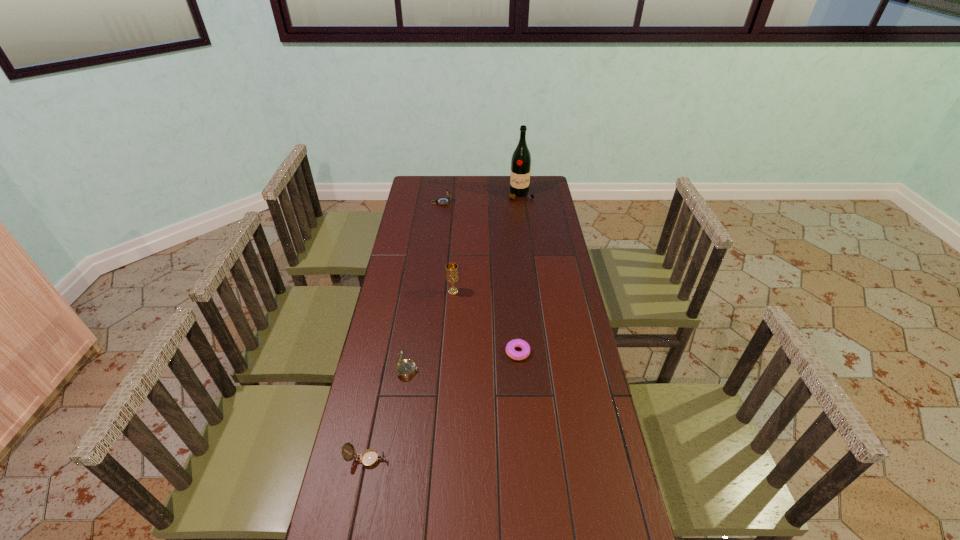
Identify the location of unoccupied position between the chalice and the shortest object. This screenshot has width=960, height=540. (486, 322).

Locate an element on the screen. This screenshot has width=960, height=540. vacant space that is in between the chalice and the second farthest compass is located at coordinates (430, 331).

Find the location of a particular element. This screenshot has height=540, width=960. free space between the third object from right to left and the doughnut is located at coordinates (486, 322).

At what (x,y) coordinates should I click in order to perform the action: click on free spot between the farthest compass and the third farthest object. Please return your answer as a coordinate pair (x, y). The height and width of the screenshot is (540, 960). Looking at the image, I should click on (447, 247).

Locate an element on the screen. This screenshot has height=540, width=960. free space between the doughnut and the third object from right to left is located at coordinates (486, 322).

At what (x,y) coordinates should I click in order to perform the action: click on vacant space that's between the second farthest compass and the farthest compass. Please return your answer as a coordinate pair (x, y). Looking at the image, I should click on (424, 286).

Where is `empty location between the second farthest compass and the second shortest object`? Image resolution: width=960 pixels, height=540 pixels. empty location between the second farthest compass and the second shortest object is located at coordinates (387, 415).

Locate an element on the screen. free space that is in between the nearest compass and the second farthest compass is located at coordinates (387, 415).

Locate an element on the screen. This screenshot has height=540, width=960. unoccupied area between the chalice and the second farthest compass is located at coordinates (430, 331).

Find the location of a particular element. The width and height of the screenshot is (960, 540). free space between the fifth shortest object and the shortest object is located at coordinates (486, 322).